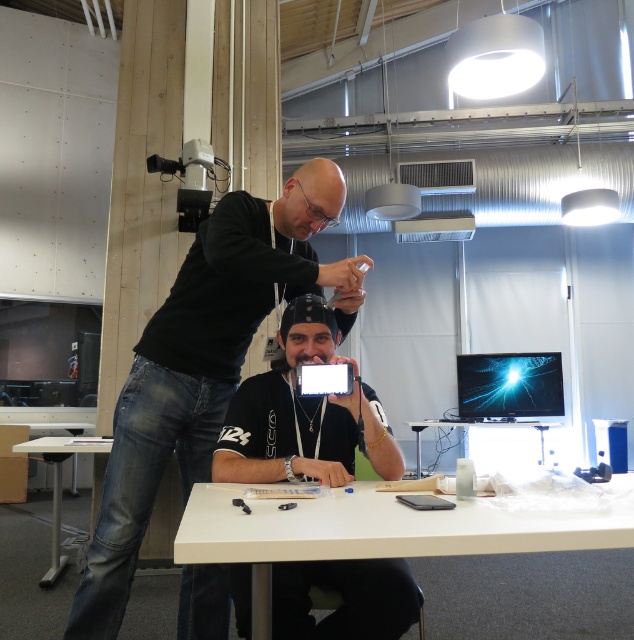
Is black matte phone at center further to the viewer compared to white glossy table at lower center?

Yes.

Does black matte phone at center appear under white glossy table at lower center?

Actually, black matte phone at center is above white glossy table at lower center.

Which is in front, point (340, 305) or point (458, 534)?

Positioned in front is point (458, 534).

This screenshot has width=634, height=640. What are the coordinates of `black matte phone at center` in the screenshot? It's located at (202, 365).

Is black matte phone at center wider than white plastic table at lower left?

Correct, the width of black matte phone at center exceeds that of white plastic table at lower left.

Measure the distance between point (356,301) and camera.

Point (356,301) is 5.79 feet away from camera.

Which is behind, point (155, 484) or point (22, 445)?

The point (22, 445) is more distant.

This screenshot has width=634, height=640. Find the location of `black matte phone at center`. black matte phone at center is located at coordinates (202, 365).

Can you confirm if black matte shirt at center is wider than white plastic table at center?

No, black matte shirt at center is not wider than white plastic table at center.

Is point (288, 564) positioned before point (418, 452)?

Yes, it is in front of point (418, 452).

Is point (363, 600) in front of point (533, 424)?

Yes, point (363, 600) is closer to viewer.

Identify the location of black matte shirt at center. This screenshot has width=634, height=640. (302, 413).